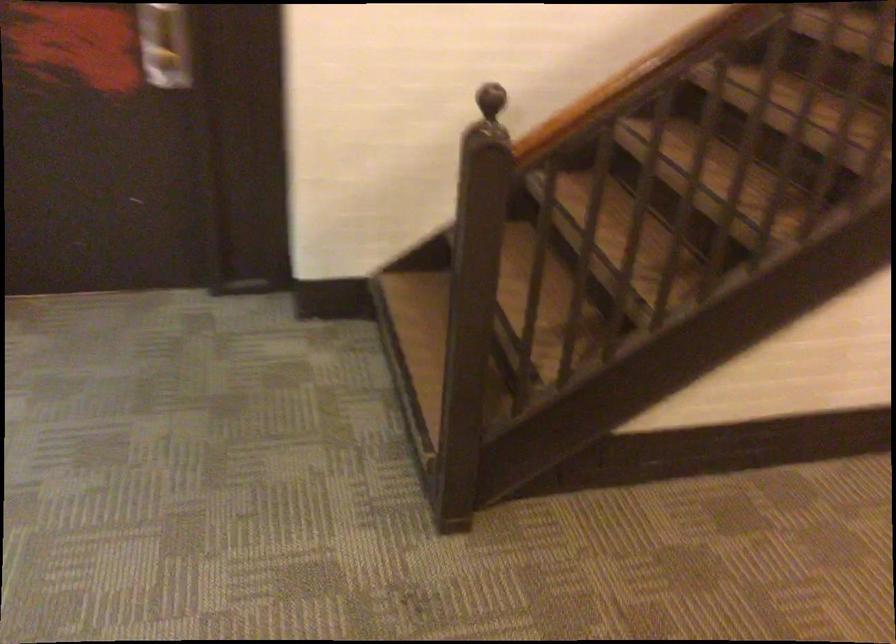
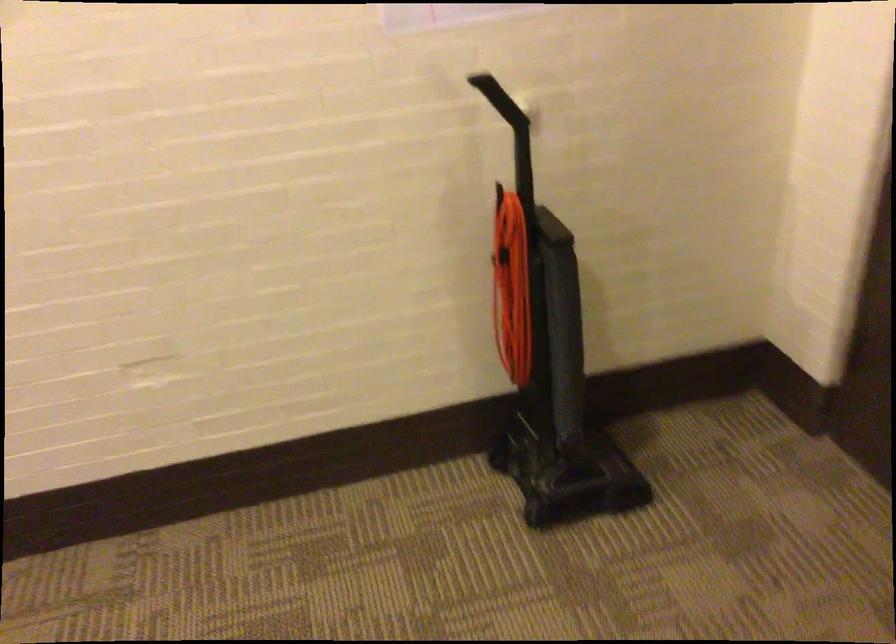
Question: Which direction would the cameraman need to move to produce the second image? Reply with the corresponding letter.

Choices:
 (A) Left
 (B) Right
 (C) Forward
 (D) Backward

Answer: (B)